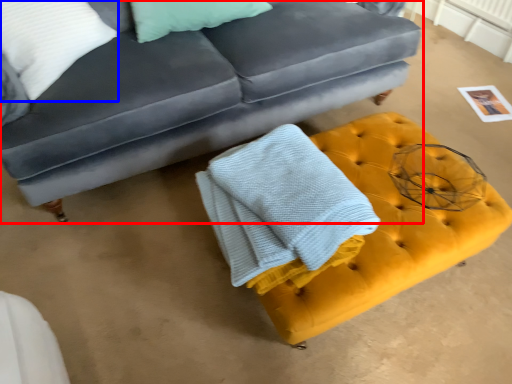
Question: Among these objects, which one is farthest to the camera, studio couch (highlighted by a red box) or pillow (highlighted by a blue box)?

Choices:
 (A) studio couch
 (B) pillow

Answer: (B)